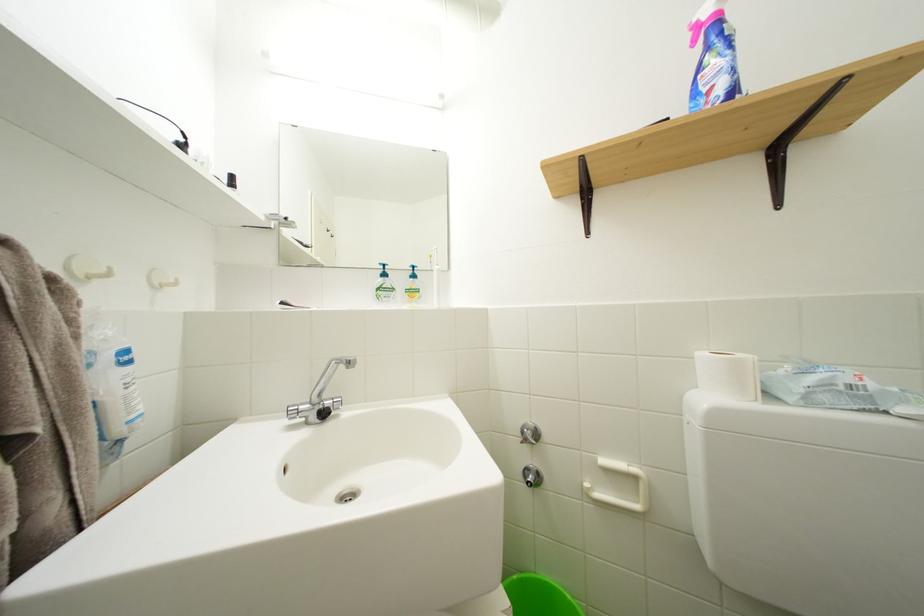
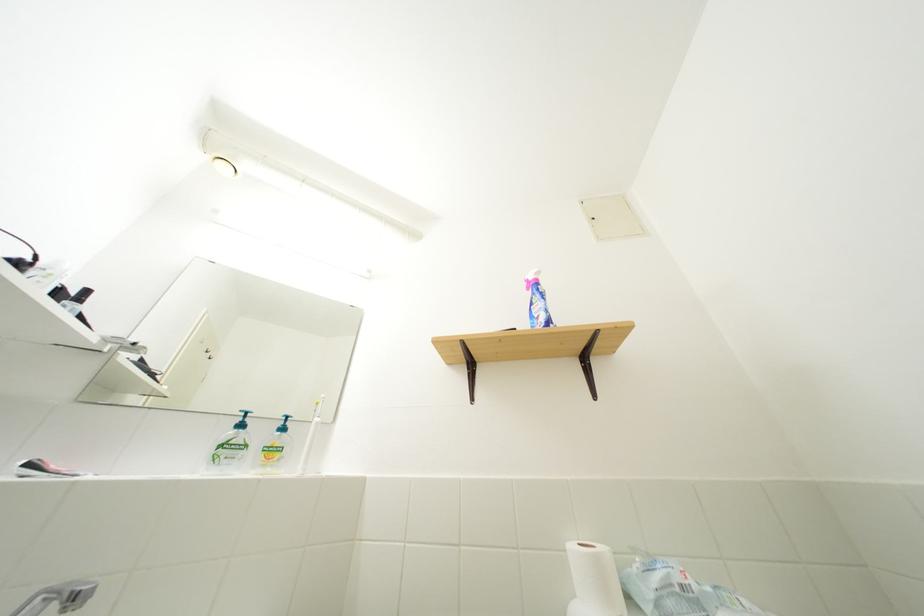
First-person continuous shooting, in which direction is the camera rotating?

The camera's rotation is toward right-up.